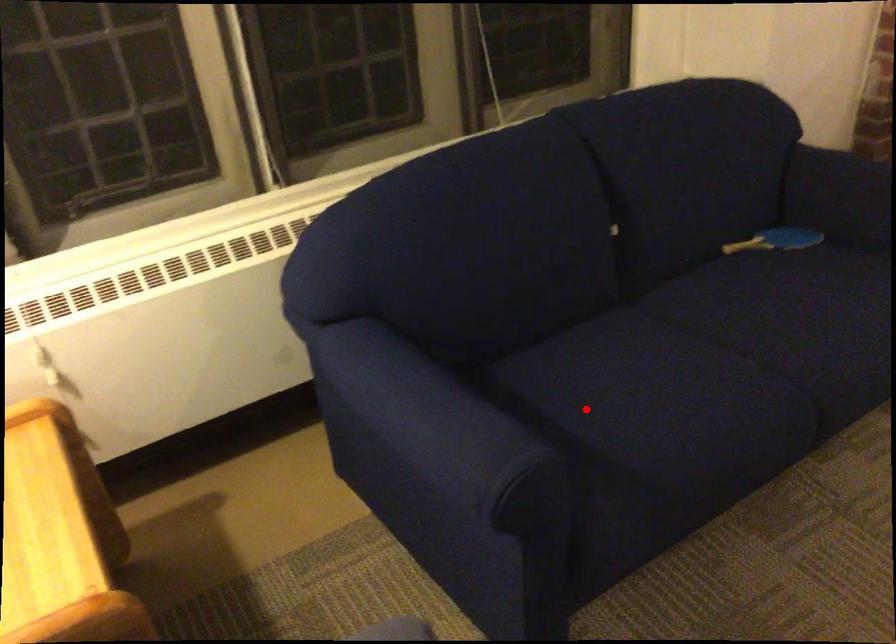
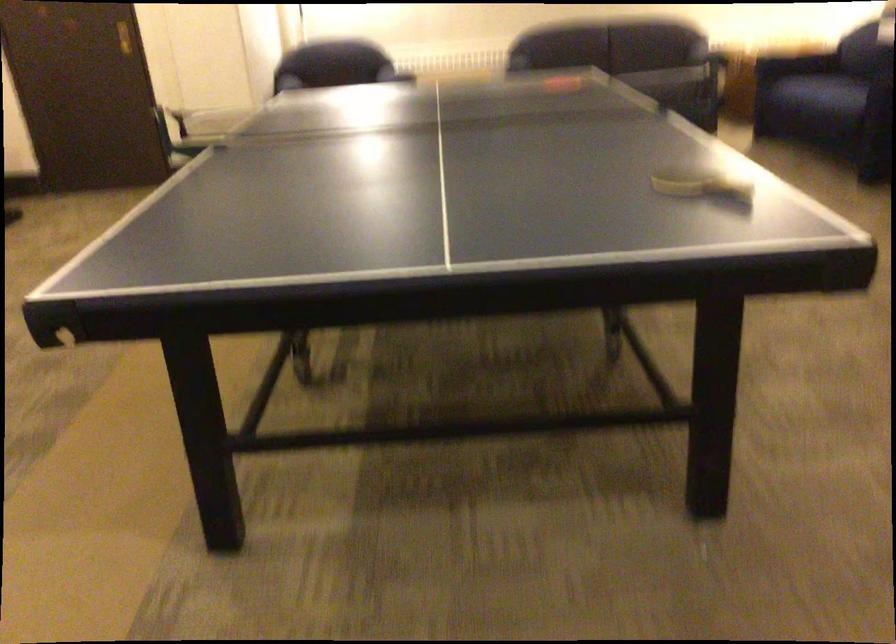
In the second image, find the point that corresponds to the highlighted location in the first image.

(794, 64)